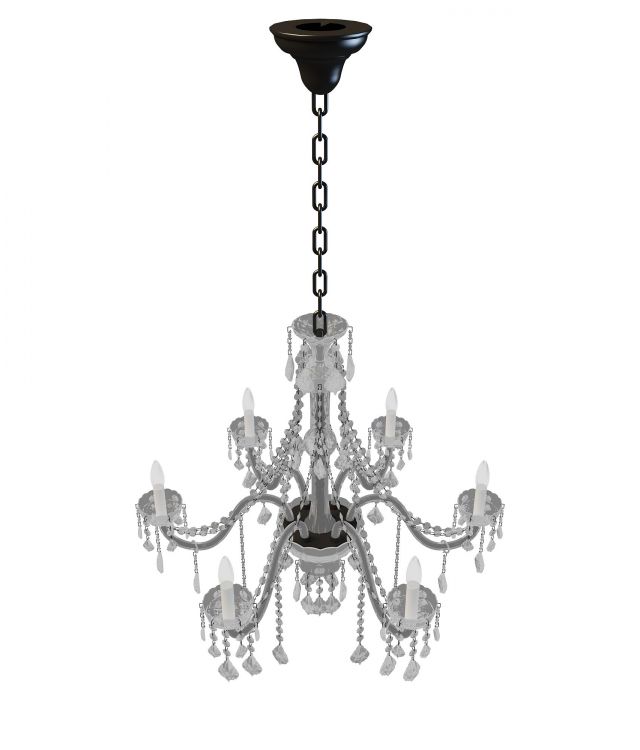
Where is `middle hanging crystals`? The width and height of the screenshot is (640, 750). middle hanging crystals is located at coordinates (308, 604), (322, 609), (333, 604), (339, 597), (333, 578), (308, 578), (294, 589).